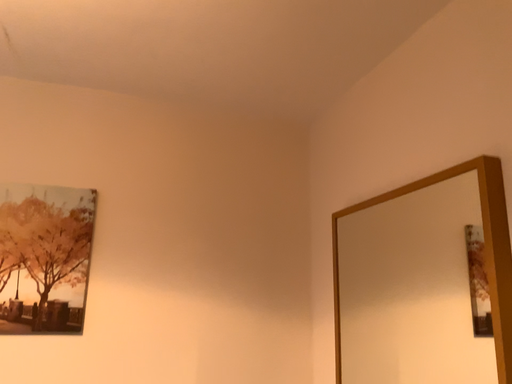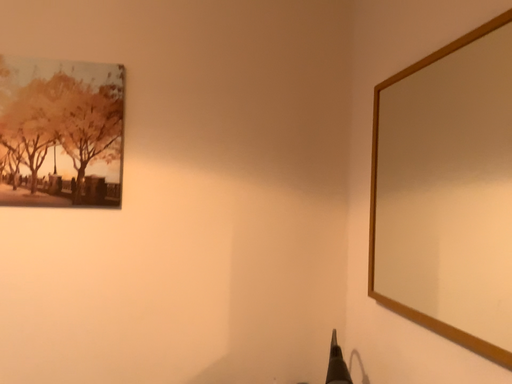
Question: How did the camera likely rotate when shooting the video?

Choices:
 (A) rotated left
 (B) rotated right

Answer: (A)